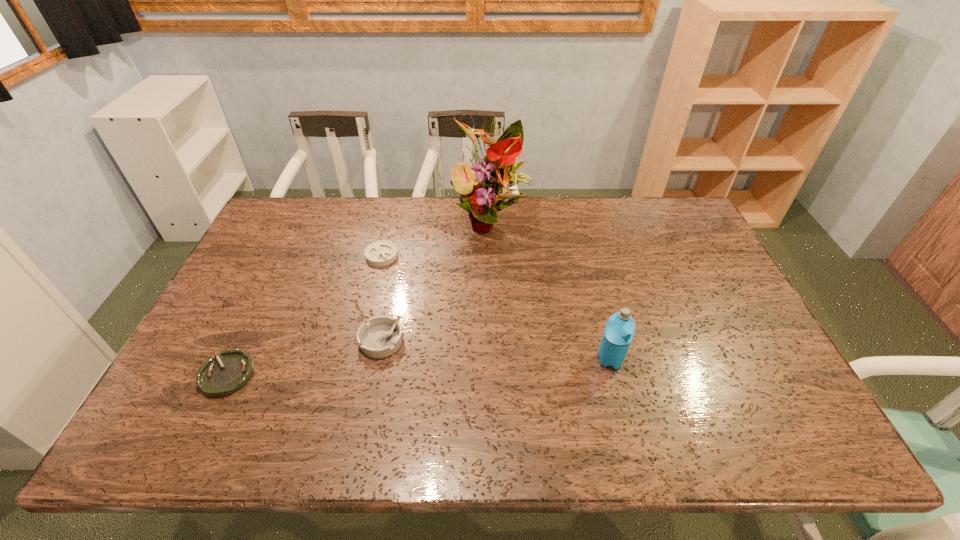
Locate an element on the screen. The width and height of the screenshot is (960, 540). bouquet is located at coordinates (491, 177).

This screenshot has height=540, width=960. I want to click on the second object from right to left, so click(491, 177).

What are the coordinates of `thermos bottle` in the screenshot? It's located at (618, 333).

This screenshot has width=960, height=540. In order to click on the rightmost object in this screenshot , I will do 618,333.

You are a GUI agent. You are given a task and a screenshot of the screen. Output one action in this format:
    pyautogui.click(x=<x>, y=<y>)
    Task: Click on the tallest ashtray
    This screenshot has height=540, width=960.
    Given the screenshot: What is the action you would take?
    pyautogui.click(x=381, y=337)

Identify the location of the farthest ashtray. This screenshot has height=540, width=960. (380, 253).

At what (x,y) coordinates should I click in order to perform the action: click on the leftmost object. Please return your answer as a coordinate pair (x, y). Looking at the image, I should click on (220, 376).

Image resolution: width=960 pixels, height=540 pixels. In order to click on free location located on the front-facing side of the second object from right to left in this screenshot , I will do `click(492, 321)`.

The width and height of the screenshot is (960, 540). I want to click on blank area located on the right of the thermos bottle, so click(731, 359).

I want to click on free space located on the front of the third tallest object, so click(x=369, y=402).